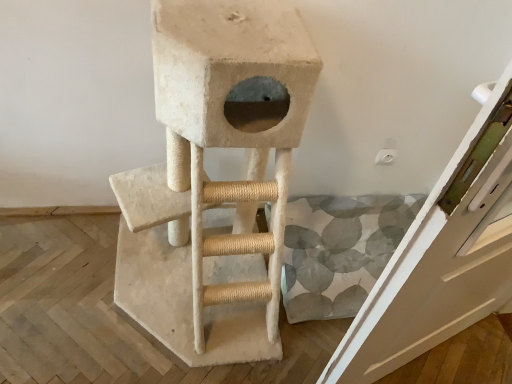
The image size is (512, 384). In order to click on free space to the left of beige felt cat tree at center in this screenshot , I will do `click(60, 278)`.